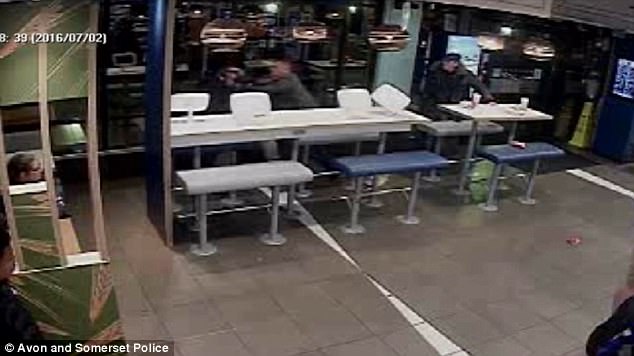
Where is `light`? This screenshot has width=634, height=356. light is located at coordinates (224, 41), (314, 32), (392, 34).